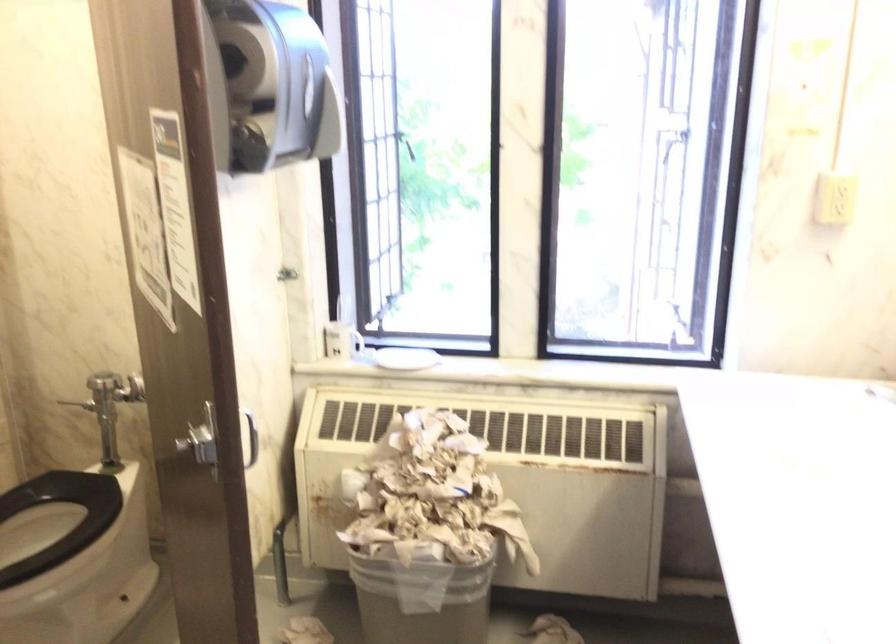
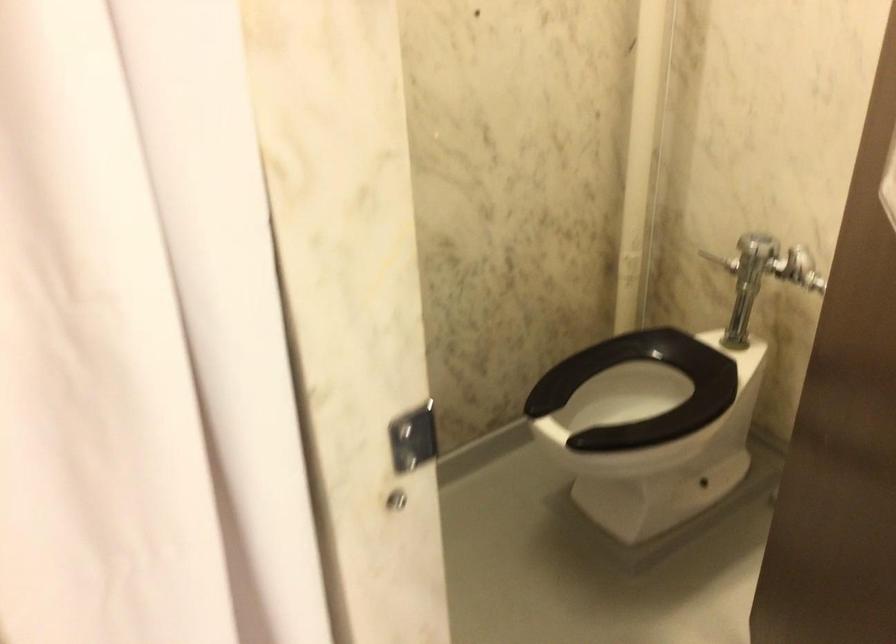
The images are taken continuously from a first-person perspective. In which direction is your viewpoint rotating?

The rotation direction of the camera is left-down.